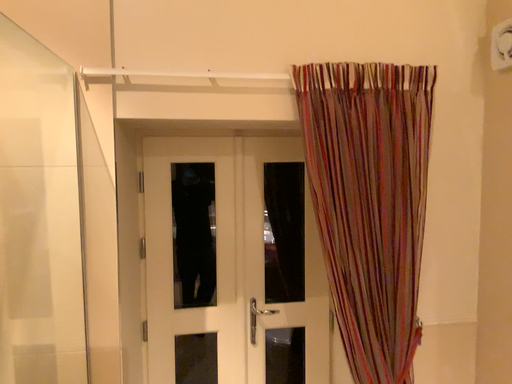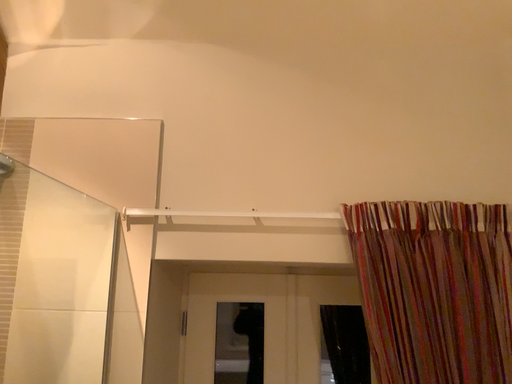
Question: How did the camera likely rotate when shooting the video?

Choices:
 (A) rotated left
 (B) rotated right

Answer: (A)